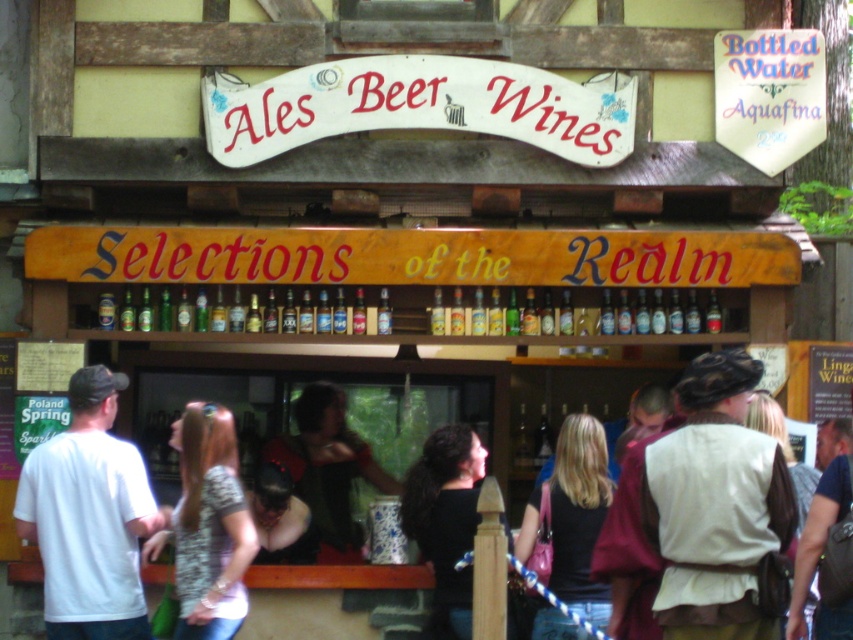
Question: Is patterned fabric shirt at lower left below black fabric at center?

Choices:
 (A) no
 (B) yes

Answer: (A)

Question: Which point is farther to the camera?

Choices:
 (A) (45, 630)
 (B) (405, 486)

Answer: (B)

Question: Does white t-shirt at left appear on the left side of dark green leather vest at center?

Choices:
 (A) no
 (B) yes

Answer: (B)

Question: Which point appears closest to the camera in this image?

Choices:
 (A) (125, 490)
 (B) (283, 477)

Answer: (A)

Question: Which point appears closest to the camera in this image?

Choices:
 (A) (88, 424)
 (B) (305, 509)

Answer: (A)

Question: From the image, what is the correct spatial relationship of black fabric shirt at center in relation to dark green leather vest at center?

Choices:
 (A) below
 (B) above

Answer: (A)